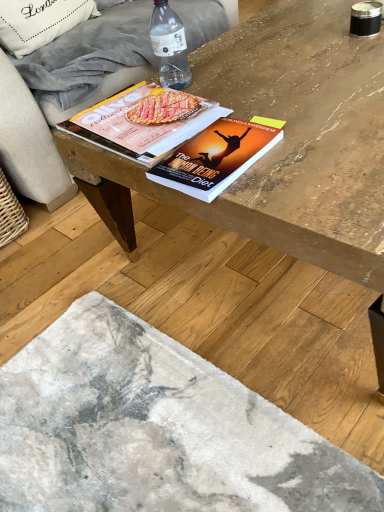
I want to click on free space between matte paper magazine at center, which is the 2th book from front to back, and transparent plastic bottle at upper center, so click(x=196, y=92).